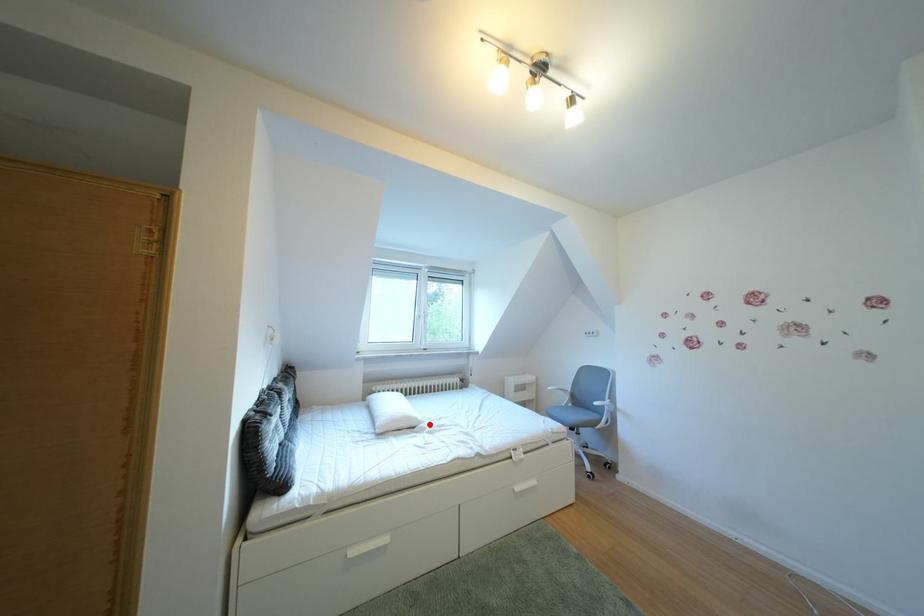
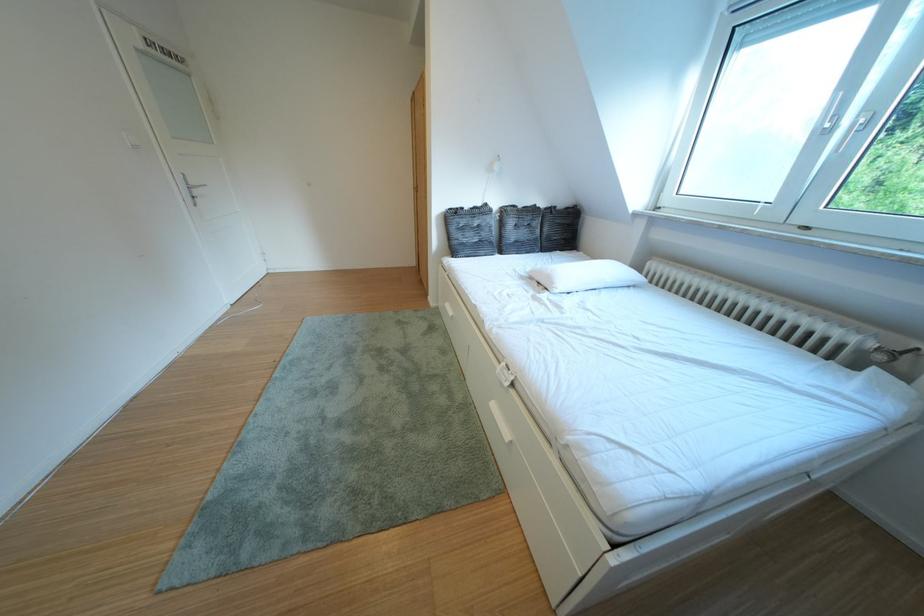
Where in the second image is the point corresponding to the highlighted location from the first image?

(565, 288)